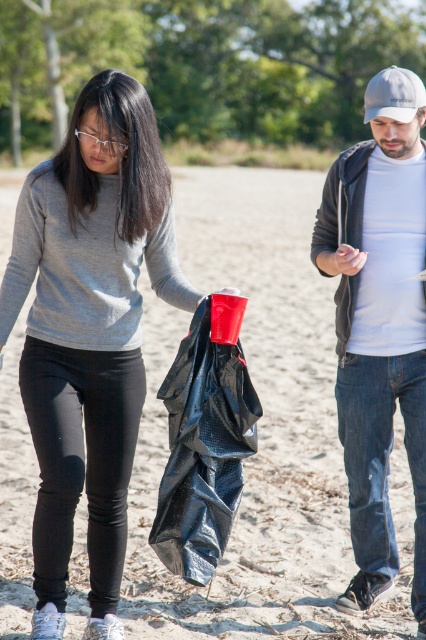
Question: Is the position of matte black jacket at center more distant than that of white fabric baseball cap at upper right?

Choices:
 (A) no
 (B) yes

Answer: (A)

Question: Which object appears farthest from the camera in this image?

Choices:
 (A) denim jacket at right
 (B) matte black jacket at center
 (C) white fabric baseball cap at upper right
 (D) black matte bag at center

Answer: (C)

Question: In this image, where is black matte bag at center located relative to white fabric baseball cap at upper right?

Choices:
 (A) below
 (B) above

Answer: (A)

Question: Is denim jacket at right further to the viewer compared to black matte bag at center?

Choices:
 (A) yes
 (B) no

Answer: (A)

Question: Among these objects, which one is farthest from the camera?

Choices:
 (A) white fabric baseball cap at upper right
 (B) black matte bag at center

Answer: (A)

Question: Estimate the real-world distances between objects in this image. Which object is closer to the matte black jacket at center?

Choices:
 (A) white fabric baseball cap at upper right
 (B) black matte bag at center

Answer: (B)